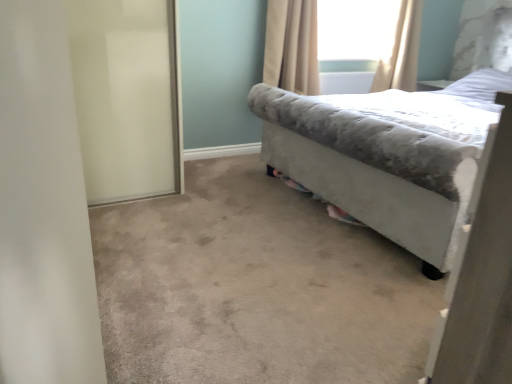
Question: Is white frosted glass screen door at left thinner than velvet gray bed at right?

Choices:
 (A) yes
 (B) no

Answer: (A)

Question: Is white frosted glass screen door at left not close to velvet gray bed at right?

Choices:
 (A) yes
 (B) no

Answer: (A)

Question: Considering the relative positions of white frosted glass screen door at left and velvet gray bed at right in the image provided, is white frosted glass screen door at left behind velvet gray bed at right?

Choices:
 (A) no
 (B) yes

Answer: (B)

Question: Can you confirm if white frosted glass screen door at left is positioned to the left of velvet gray bed at right?

Choices:
 (A) no
 (B) yes

Answer: (B)

Question: Is white frosted glass screen door at left aimed at velvet gray bed at right?

Choices:
 (A) no
 (B) yes

Answer: (A)

Question: Does white frosted glass screen door at left have a greater width compared to velvet gray bed at right?

Choices:
 (A) no
 (B) yes

Answer: (A)

Question: Is white frosted glass screen door at left bigger than beige fabric curtain at upper center, marked as the first curtain in a left-to-right arrangement?

Choices:
 (A) yes
 (B) no

Answer: (A)

Question: Considering the relative sizes of white frosted glass screen door at left and beige fabric curtain at upper center, the 2th curtain in the right-to-left sequence, in the image provided, is white frosted glass screen door at left smaller than beige fabric curtain at upper center, the 2th curtain in the right-to-left sequence,?

Choices:
 (A) no
 (B) yes

Answer: (A)

Question: From the image's perspective, is white frosted glass screen door at left on top of beige fabric curtain at upper center, the 2th curtain in the right-to-left sequence?

Choices:
 (A) no
 (B) yes

Answer: (A)

Question: Is white frosted glass screen door at left oriented away from beige fabric curtain at upper center, marked as the first curtain in a left-to-right arrangement?

Choices:
 (A) yes
 (B) no

Answer: (B)

Question: Can you confirm if white frosted glass screen door at left is thinner than beige fabric curtain at upper center, marked as the first curtain in a left-to-right arrangement?

Choices:
 (A) no
 (B) yes

Answer: (A)

Question: Considering the relative sizes of white frosted glass screen door at left and beige fabric curtain at upper center, marked as the first curtain in a left-to-right arrangement, in the image provided, is white frosted glass screen door at left shorter than beige fabric curtain at upper center, marked as the first curtain in a left-to-right arrangement,?

Choices:
 (A) no
 (B) yes

Answer: (A)

Question: Is white frosted glass screen door at left in contact with transparent glass window screen at upper center?

Choices:
 (A) no
 (B) yes

Answer: (A)